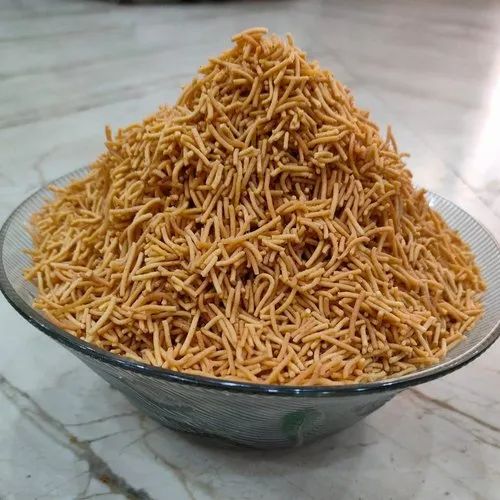
The image size is (500, 500). Find the location of `rim of bowl`. rim of bowl is located at coordinates (284, 398), (325, 395), (230, 380).